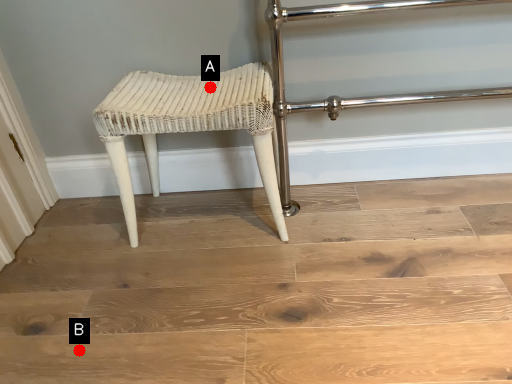
Question: Two points are circled on the image, labeled by A and B beside each circle. Which point is farther to the camera?

Choices:
 (A) A is further
 (B) B is further

Answer: (A)